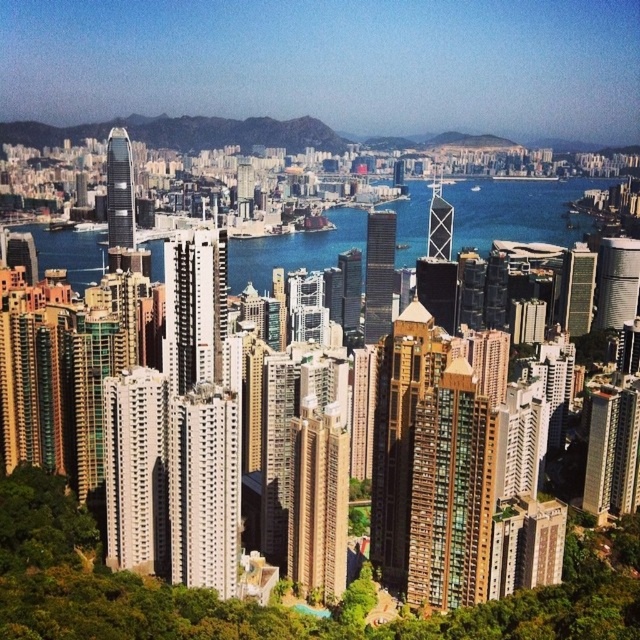
Between white glass building at center and metallic glass skyscraper at center-right, which one is positioned lower?

metallic glass skyscraper at center-right

Between point (131, 468) and point (612, 483), which one is positioned behind?

The point (612, 483) is behind.

Locate an element on the screen. This screenshot has height=640, width=640. white glass building at center is located at coordinates (134, 470).

Identify the location of white glass building at center. (134, 470).

Which is more to the left, white glass building at center or matte glass building at center?

white glass building at center is more to the left.

Between white glass building at center and matte glass building at center, which one appears on the right side from the viewer's perspective?

Positioned to the right is matte glass building at center.

Does point (132, 472) lie in front of point (179, 365)?

That is True.

The width and height of the screenshot is (640, 640). I want to click on white glass building at center, so click(x=134, y=470).

At what (x,y) coordinates should I click in order to perform the action: click on blue glassy water at center. Please return your answer as a coordinate pair (x, y). Looking at the image, I should click on (518, 211).

Between blue glassy water at center and glassy steel skyscraper at center, which one is positioned higher?

blue glassy water at center

This screenshot has width=640, height=640. In order to click on blue glassy water at center in this screenshot , I will do `click(518, 211)`.